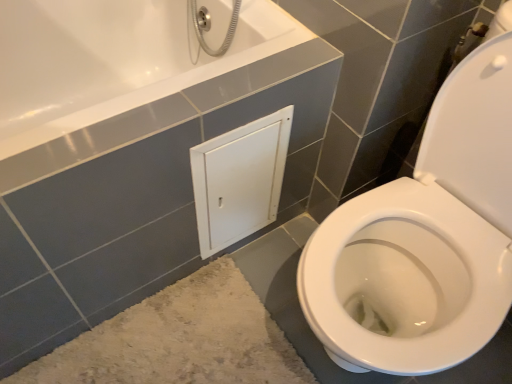
What is the approximate width of white matte cabinet at center?

0.92 inches.

What are the coordinates of `white matte cabinet at center` in the screenshot? It's located at (239, 180).

The image size is (512, 384). What do you see at coordinates (239, 180) in the screenshot? I see `white matte cabinet at center` at bounding box center [239, 180].

Identify the location of beige shaggy bath mat at lower left. The image size is (512, 384). (179, 339).

Describe the element at coordinates (179, 339) in the screenshot. The height and width of the screenshot is (384, 512). I see `beige shaggy bath mat at lower left` at that location.

This screenshot has width=512, height=384. I want to click on white matte cabinet at center, so click(239, 180).

Can you confirm if white matte cabinet at center is positioned to the left of beige shaggy bath mat at lower left?

No, white matte cabinet at center is not to the left of beige shaggy bath mat at lower left.

Is the depth of white matte cabinet at center greater than that of beige shaggy bath mat at lower left?

Yes, white matte cabinet at center is further from the viewer.

Is point (254, 140) closer or farther from the camera than point (219, 319)?

Point (254, 140) is positioned closer to the camera compared to point (219, 319).

From the image's perspective, between white matte cabinet at center and beige shaggy bath mat at lower left, who is located below?

beige shaggy bath mat at lower left is shown below in the image.

Looking at this image, from a real-world perspective, is white matte cabinet at center over beige shaggy bath mat at lower left?

Correct, in the physical world, white matte cabinet at center is higher than beige shaggy bath mat at lower left.

Is white matte cabinet at center wider or thinner than beige shaggy bath mat at lower left?

Clearly, white matte cabinet at center has less width compared to beige shaggy bath mat at lower left.

Between white matte cabinet at center and beige shaggy bath mat at lower left, which one has more height?

Standing taller between the two is white matte cabinet at center.

Is white matte cabinet at center smaller than beige shaggy bath mat at lower left?

Indeed, white matte cabinet at center has a smaller size compared to beige shaggy bath mat at lower left.

Which is correct: white matte cabinet at center is inside beige shaggy bath mat at lower left, or outside of it?

white matte cabinet at center exists outside the volume of beige shaggy bath mat at lower left.

Is white matte cabinet at center not near beige shaggy bath mat at lower left?

No.

Is white matte cabinet at center positioned with its back to beige shaggy bath mat at lower left?

That's not correct — white matte cabinet at center is not looking away from beige shaggy bath mat at lower left.

This screenshot has height=384, width=512. In the image, there is a beige shaggy bath mat at lower left. In order to click on medicine cabinet above it (from the image's perspective) in this screenshot , I will do `click(239, 180)`.

Considering the relative positions of beige shaggy bath mat at lower left and white matte cabinet at center in the image provided, is beige shaggy bath mat at lower left to the left of white matte cabinet at center from the viewer's perspective?

Correct, you'll find beige shaggy bath mat at lower left to the left of white matte cabinet at center.

Considering the positions of objects beige shaggy bath mat at lower left and white matte cabinet at center in the image provided, who is in front, beige shaggy bath mat at lower left or white matte cabinet at center?

beige shaggy bath mat at lower left.

Is point (197, 272) farther from viewer compared to point (271, 196)?

Yes.

From the image's perspective, does beige shaggy bath mat at lower left appear lower than white matte cabinet at center?

Correct, beige shaggy bath mat at lower left appears lower than white matte cabinet at center in the image.

From a real-world perspective, who is located lower, beige shaggy bath mat at lower left or white matte cabinet at center?

In real-world perspective, beige shaggy bath mat at lower left is lower.

Does beige shaggy bath mat at lower left have a lesser width compared to white matte cabinet at center?

Incorrect, the width of beige shaggy bath mat at lower left is not less than that of white matte cabinet at center.

From the picture: In terms of height, does beige shaggy bath mat at lower left look taller or shorter compared to white matte cabinet at center?

In the image, beige shaggy bath mat at lower left appears to be shorter than white matte cabinet at center.

Does beige shaggy bath mat at lower left have a smaller size compared to white matte cabinet at center?

Actually, beige shaggy bath mat at lower left might be larger than white matte cabinet at center.

Is beige shaggy bath mat at lower left surrounding white matte cabinet at center?

Definitely not — white matte cabinet at center is not inside beige shaggy bath mat at lower left.

Is beige shaggy bath mat at lower left far from white matte cabinet at center?

That's not correct — beige shaggy bath mat at lower left is a little close to white matte cabinet at center.

Is beige shaggy bath mat at lower left oriented away from white matte cabinet at center?

No.

In the image, there is a white matte cabinet at center. Where is `bath mat below it (from a real-world perspective)`? This screenshot has width=512, height=384. bath mat below it (from a real-world perspective) is located at coordinates (179, 339).

Find the location of a particular element. bath mat to the left of white matte cabinet at center is located at coordinates [179, 339].

Where is `medicine cabinet above the beige shaggy bath mat at lower left (from the image's perspective)`? medicine cabinet above the beige shaggy bath mat at lower left (from the image's perspective) is located at coordinates (239, 180).